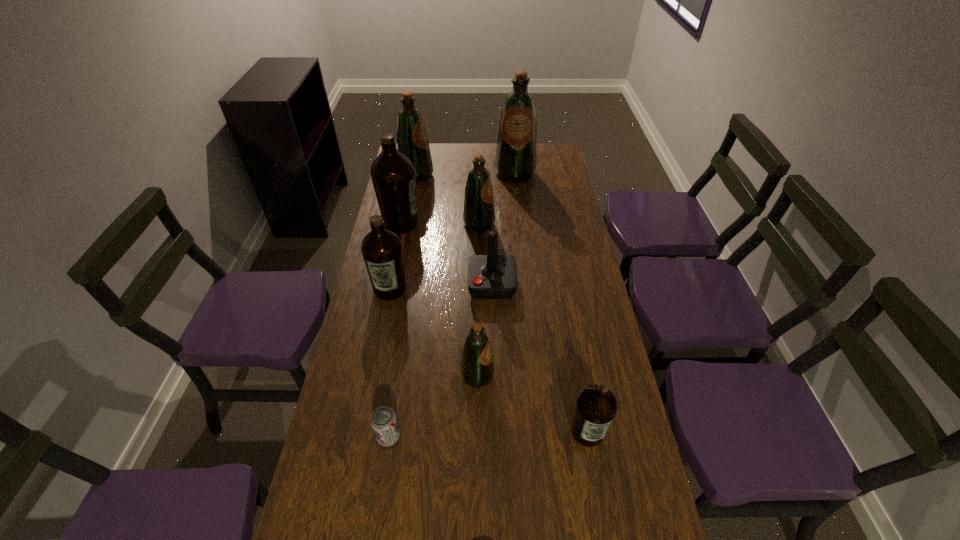
I want to click on the second closest green olive oil to the joystick, so click(477, 369).

The height and width of the screenshot is (540, 960). I want to click on the second closest green olive oil to the third smallest green olive oil, so click(515, 161).

Identify which brown olive oil is located as the second nearest to the rightmost green olive oil. Please provide its 2D coordinates. Your answer should be formatted as a tuple, i.e. [(x, y)], where the tuple contains the x and y coordinates of a point satisfying the conditions above.

[(382, 251)]

This screenshot has width=960, height=540. Identify the location of the second closest brown olive oil to the third biggest green olive oil. click(x=382, y=251).

Identify the location of vacant space that satisfies the following two spatial constraints: 1. on the front-facing side of the joystick; 2. on the left side of the leftmost green olive oil. (396, 285).

You are a GUI agent. You are given a task and a screenshot of the screen. Output one action in this format:
    pyautogui.click(x=<x>, y=<y>)
    Task: Click on the free space that satisfies the following two spatial constraints: 1. on the label of the shortest object; 2. on the right side of the fifth farthest olive oil
    This screenshot has height=540, width=960.
    Given the screenshot: What is the action you would take?
    pyautogui.click(x=361, y=437)

Where is `free space that satisfies the following two spatial constraints: 1. on the front-facing side of the tallest object; 2. on the label of the biggest brown olive oil`? The height and width of the screenshot is (540, 960). free space that satisfies the following two spatial constraints: 1. on the front-facing side of the tallest object; 2. on the label of the biggest brown olive oil is located at coordinates (520, 222).

Locate an element on the screen. The height and width of the screenshot is (540, 960). free space in the image that satisfies the following two spatial constraints: 1. on the front-facing side of the shortest object; 2. on the left side of the second biggest green olive oil is located at coordinates (368, 437).

This screenshot has width=960, height=540. Identify the location of vacant space that satisfies the following two spatial constraints: 1. on the front-facing side of the leftmost green olive oil; 2. on the right side of the shortest object. 368,437.